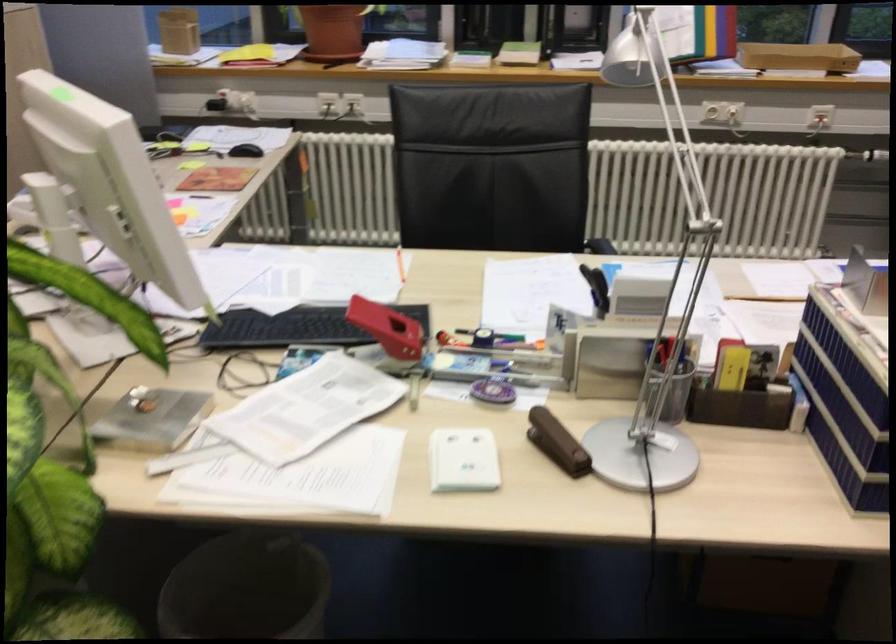
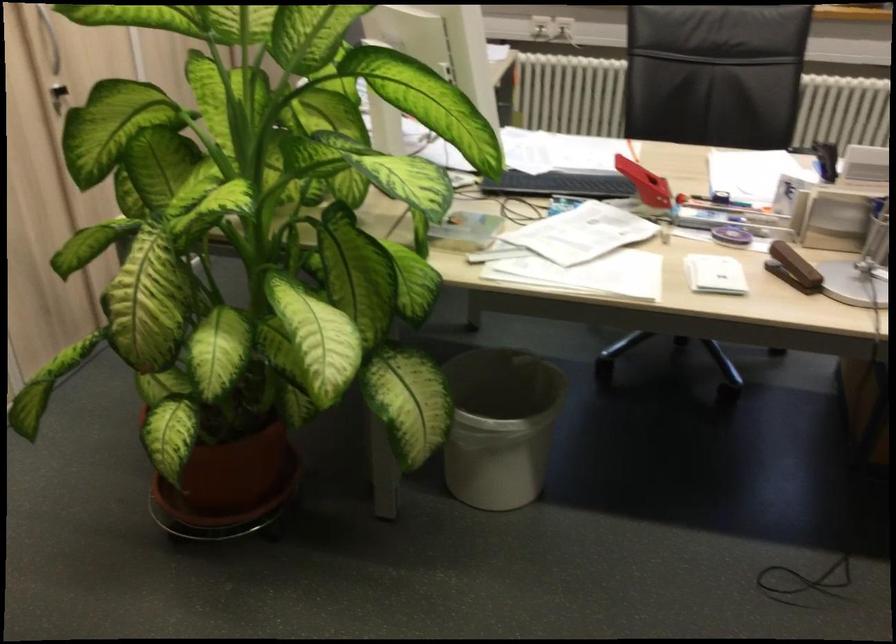
Locate, in the second image, the point that corresponds to [464,460] in the first image.

(714, 274)